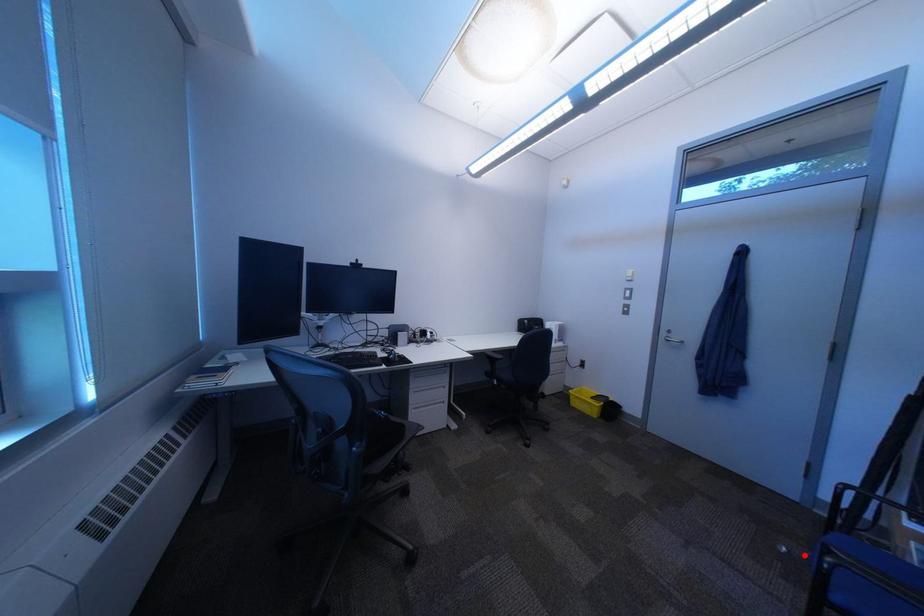
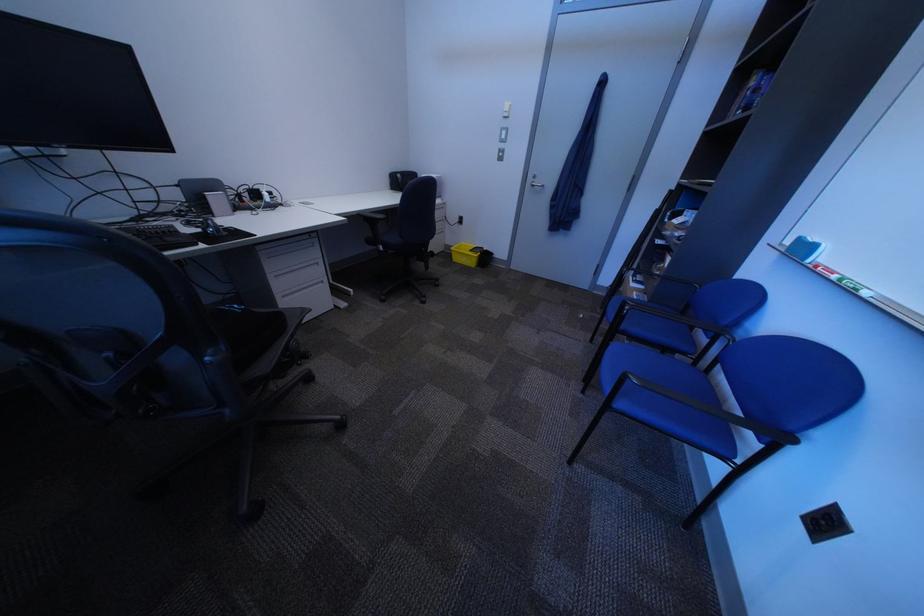
Question: I am providing you with two images of the same scene from different viewpoints. A red point is shown in image1. For the corresponding object point in image2, is it positioned nearer or farther from the camera?

Choices:
 (A) Nearer
 (B) Farther

Answer: (A)